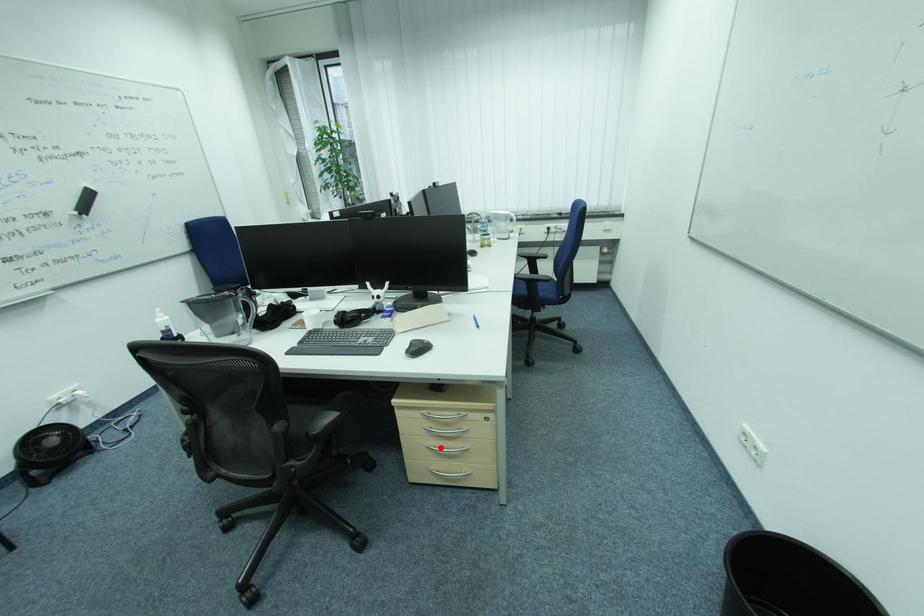
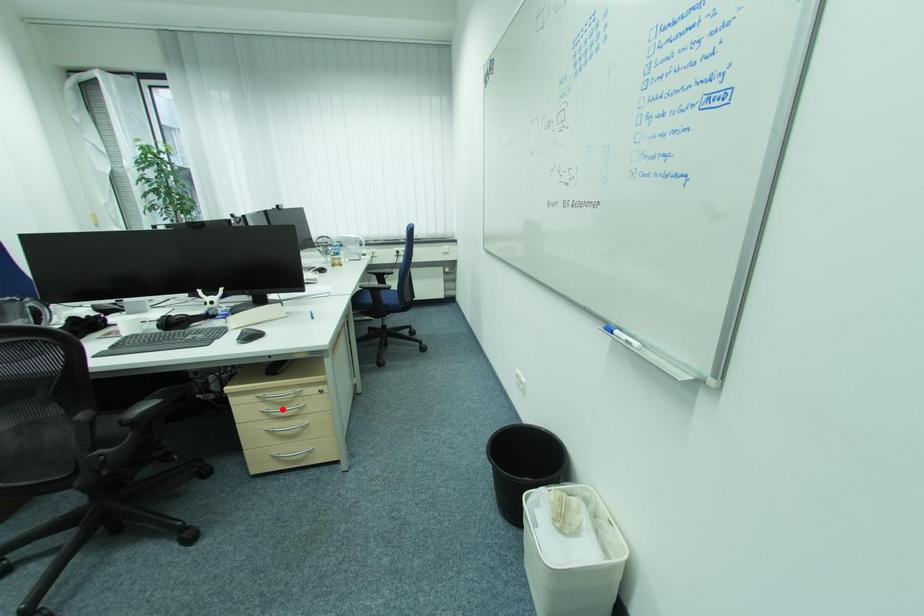
I am providing you with two images of the same scene from different viewpoints. A red point is marked on the first image and another point is marked on the second image. Is the marked point in image1 the same physical position as the marked point in image2?

No